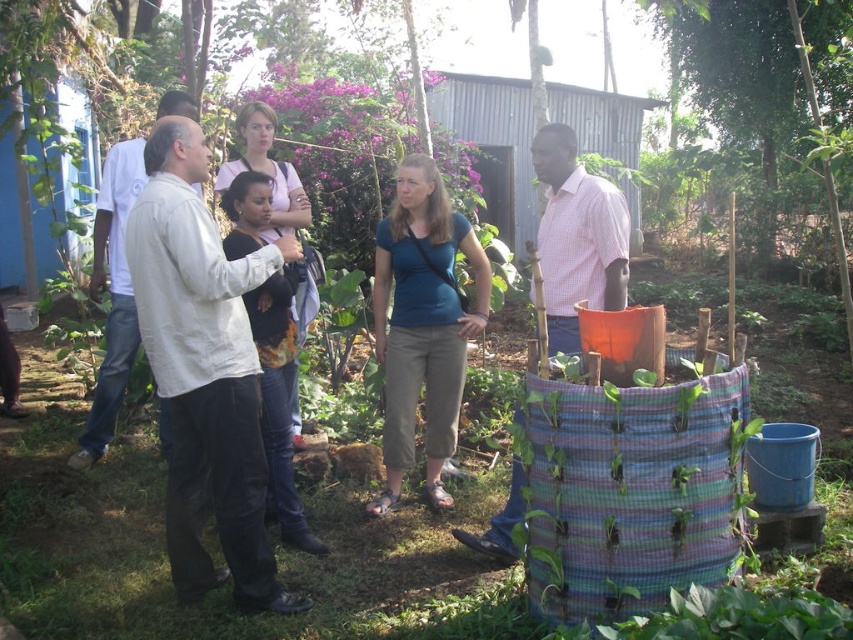
Question: Considering the relative positions of white cotton shirt at center and blue cotton shirt at center in the image provided, where is white cotton shirt at center located with respect to blue cotton shirt at center?

Choices:
 (A) left
 (B) right

Answer: (A)

Question: Does white cotton shirt at center appear on the left side of green leafy tree at upper right?

Choices:
 (A) yes
 (B) no

Answer: (A)

Question: Is white cotton shirt at center above green leafy tree at upper right?

Choices:
 (A) no
 (B) yes

Answer: (A)

Question: Which object appears closest to the camera in this image?

Choices:
 (A) blue cotton shirt at center
 (B) green leafy tree at upper right

Answer: (A)

Question: Which point appears closest to the camera in this image?

Choices:
 (A) (164, 173)
 (B) (723, 29)
 (C) (447, 433)

Answer: (A)

Question: Among these objects, which one is farthest from the camera?

Choices:
 (A) green leafy tree at upper right
 (B) blue cotton shirt at center
 (C) white cotton shirt at center

Answer: (A)